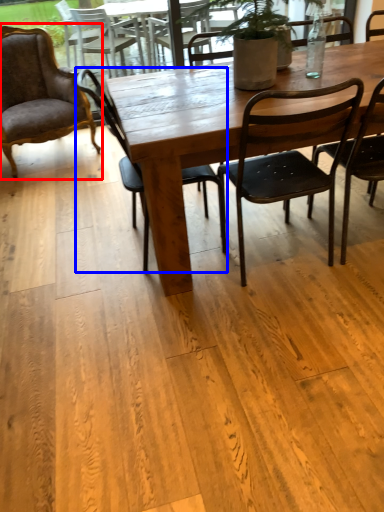
Question: Which object appears farthest to the camera in this image, chair (highlighted by a red box) or chair (highlighted by a blue box)?

Choices:
 (A) chair
 (B) chair

Answer: (A)